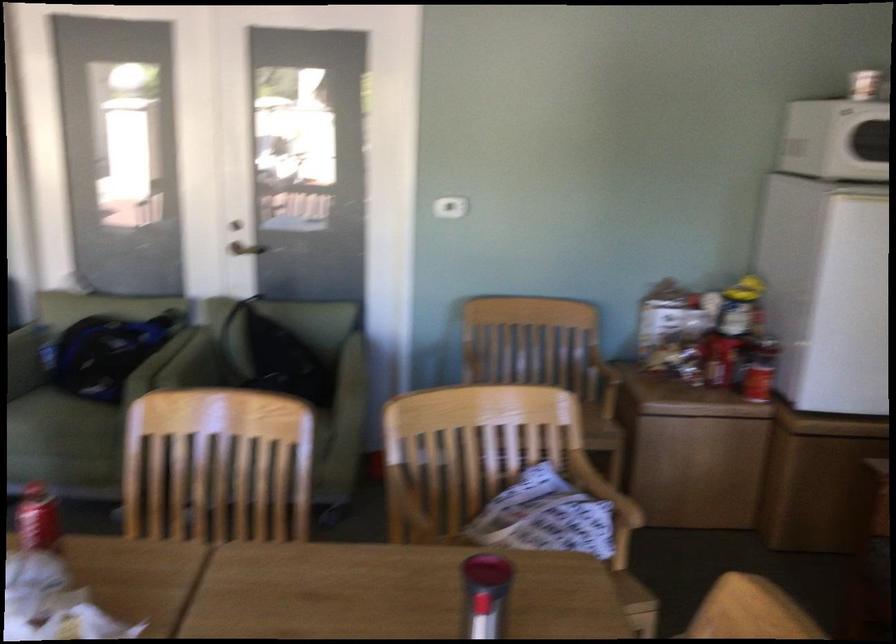
This screenshot has width=896, height=644. Find the location of `wooden cabinet lid`. wooden cabinet lid is located at coordinates (391, 592).